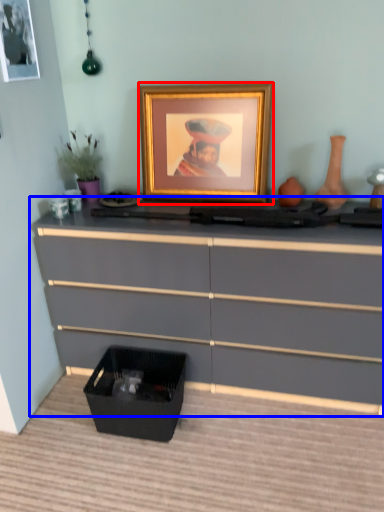
Question: Which object appears closest to the camera in this image, picture frame (highlighted by a red box) or chest of drawers (highlighted by a blue box)?

Choices:
 (A) picture frame
 (B) chest of drawers

Answer: (B)